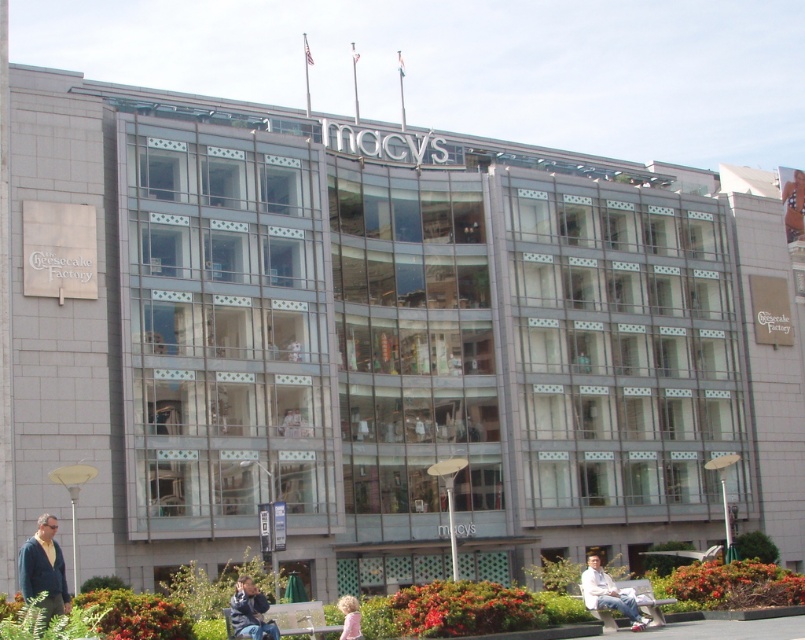
Question: Considering the relative positions of blue denim jeans at lower center and blonde hair at lower center in the image provided, where is blue denim jeans at lower center located with respect to blonde hair at lower center?

Choices:
 (A) below
 (B) above

Answer: (B)

Question: Is dark blue sweater at lower left to the left of blue denim jeans at lower center from the viewer's perspective?

Choices:
 (A) no
 (B) yes

Answer: (B)

Question: Which point is farther from the camera taking this photo?

Choices:
 (A) (50, 531)
 (B) (240, 628)
 (C) (618, 592)
 (D) (349, 636)

Answer: (C)

Question: Among these points, which one is nearest to the camera?

Choices:
 (A) (589, 584)
 (B) (254, 632)

Answer: (B)

Question: Estimate the real-world distances between objects in this image. Which object is farther from the light blue jeans at lower right?

Choices:
 (A) blue denim jeans at lower center
 (B) blonde hair at lower center

Answer: (A)

Question: Is dark blue sweater at lower left wider than blonde hair at lower center?

Choices:
 (A) yes
 (B) no

Answer: (A)